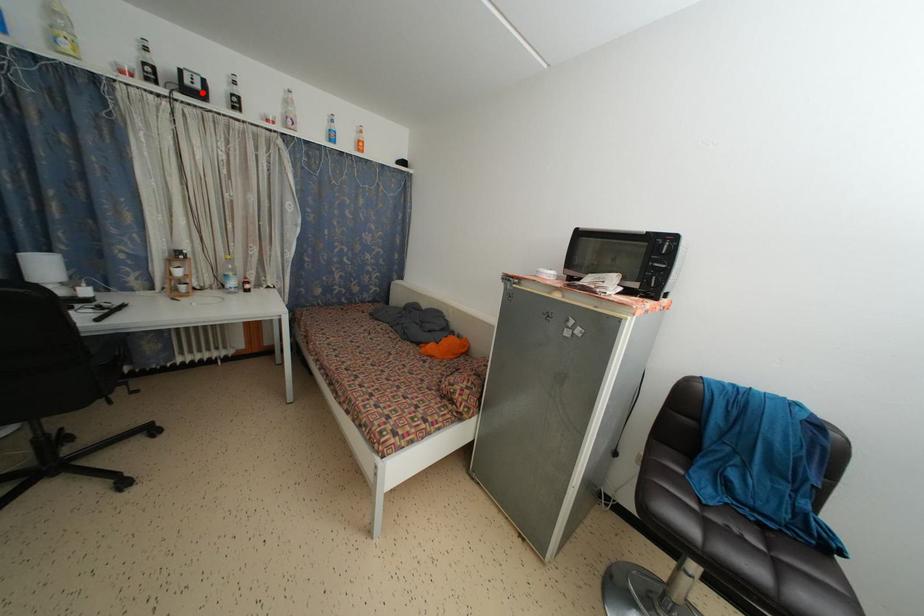
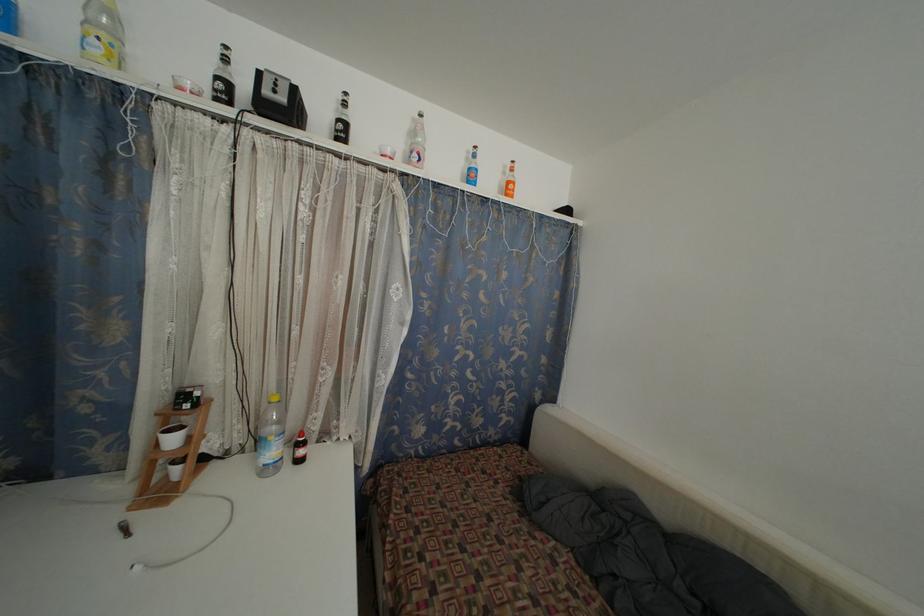
Locate, in the second image, the point that corresponds to the highlighted location in the first image.

(286, 105)